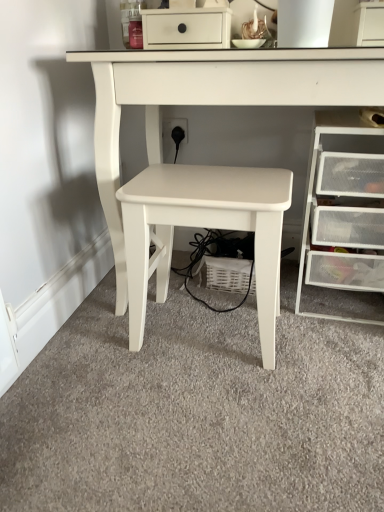
Question: Is white matte table at center, positioned as the second table in right-to-left order, positioned before clear plastic drawers at right?

Choices:
 (A) no
 (B) yes

Answer: (B)

Question: From the image's perspective, would you say white matte table at center, arranged as the 1th table when viewed from the left, is positioned over clear plastic drawers at right?

Choices:
 (A) no
 (B) yes

Answer: (A)

Question: Is white matte table at center, positioned as the second table in right-to-left order, next to clear plastic drawers at right and touching it?

Choices:
 (A) yes
 (B) no

Answer: (B)

Question: Can you confirm if white matte table at center, positioned as the second table in right-to-left order, is shorter than clear plastic drawers at right?

Choices:
 (A) no
 (B) yes

Answer: (B)

Question: Can you confirm if white matte table at center, arranged as the 1th table when viewed from the left, is thinner than clear plastic drawers at right?

Choices:
 (A) yes
 (B) no

Answer: (A)

Question: Based on their sizes in the image, would you say white matte table at center, the 1th table when ordered from right to left, is bigger or smaller than white matte table at center, arranged as the 1th table when viewed from the left?

Choices:
 (A) small
 (B) big

Answer: (B)

Question: Which is correct: white matte table at center, the 1th table when ordered from right to left, is inside white matte table at center, positioned as the second table in right-to-left order, or outside of it?

Choices:
 (A) outside
 (B) inside

Answer: (A)

Question: Would you say white matte table at center, the 2th table positioned from the left, is to the left or to the right of white matte table at center, positioned as the second table in right-to-left order, in the picture?

Choices:
 (A) right
 (B) left

Answer: (A)

Question: From the image's perspective, is white matte table at center, the 2th table positioned from the left, positioned above or below white matte table at center, arranged as the 1th table when viewed from the left?

Choices:
 (A) below
 (B) above

Answer: (B)

Question: Does point (347, 130) appear closer or farther from the camera than point (130, 232)?

Choices:
 (A) closer
 (B) farther

Answer: (B)

Question: In the image, is clear plastic drawers at right positioned in front of or behind white matte table at center, arranged as the 1th table when viewed from the left?

Choices:
 (A) front
 (B) behind

Answer: (B)

Question: From a real-world perspective, is clear plastic drawers at right positioned above or below white matte table at center, arranged as the 1th table when viewed from the left?

Choices:
 (A) above
 (B) below

Answer: (A)

Question: In terms of size, does clear plastic drawers at right appear bigger or smaller than white matte table at center, arranged as the 1th table when viewed from the left?

Choices:
 (A) big
 (B) small

Answer: (A)

Question: From the image's perspective, is clear plastic drawers at right above or below white matte table at center, the 2th table positioned from the left?

Choices:
 (A) above
 (B) below

Answer: (B)

Question: In the image, is clear plastic drawers at right positioned in front of or behind white matte table at center, the 1th table when ordered from right to left?

Choices:
 (A) front
 (B) behind

Answer: (B)